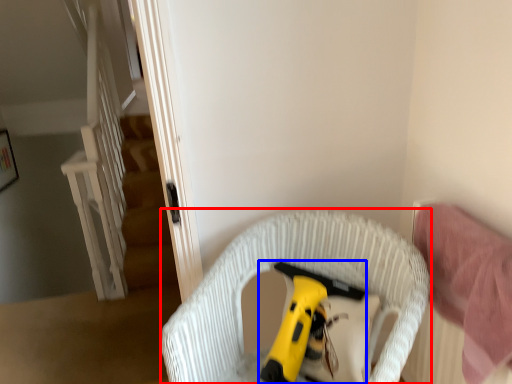
Question: Which object is further to the camera taking this photo, furniture (highlighted by a red box) or toy (highlighted by a blue box)?

Choices:
 (A) furniture
 (B) toy

Answer: (B)